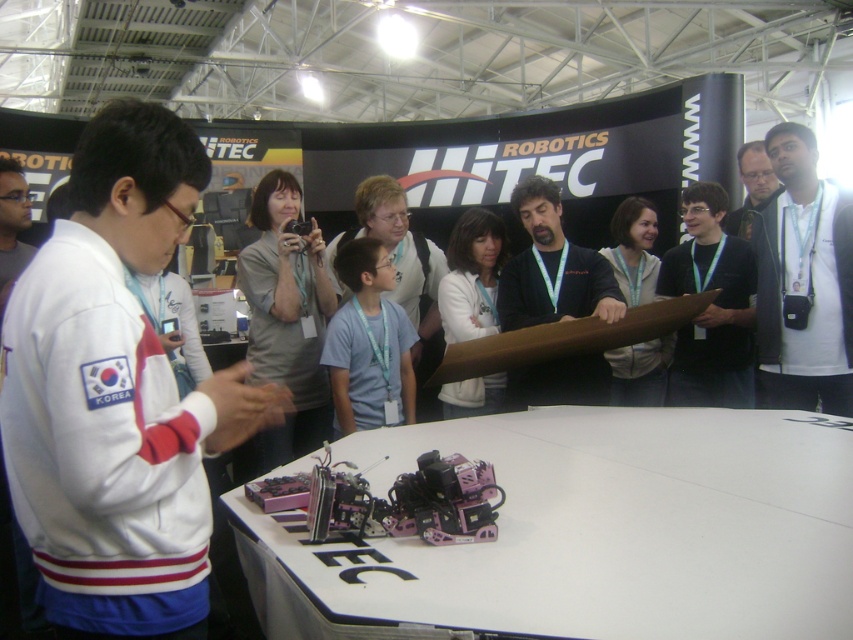
Question: Which of these objects is positioned closest to the dark blue fabric shirt at center?

Choices:
 (A) black fabric at center
 (B) white matte shirt at upper right
 (C) matte black shirt at upper right
 (D) white matte jacket at center

Answer: (D)

Question: Which of the following is the farthest from the observer?

Choices:
 (A) (561, 385)
 (B) (747, 225)
 (C) (202, 570)

Answer: (B)

Question: Which of these objects is positioned farthest from the dark blue fabric shirt at center?

Choices:
 (A) matte black shirt at upper right
 (B) white plastic table at center

Answer: (A)

Question: Is white matte jacket at center further to the viewer compared to matte black shirt at upper right?

Choices:
 (A) yes
 (B) no

Answer: (B)

Question: Is black fabric at center positioned in front of light brown leather jacket at center?

Choices:
 (A) no
 (B) yes

Answer: (B)

Question: Considering the relative positions of white fleece jacket at left and white matte shirt at upper right in the image provided, where is white fleece jacket at left located with respect to white matte shirt at upper right?

Choices:
 (A) right
 (B) left

Answer: (B)